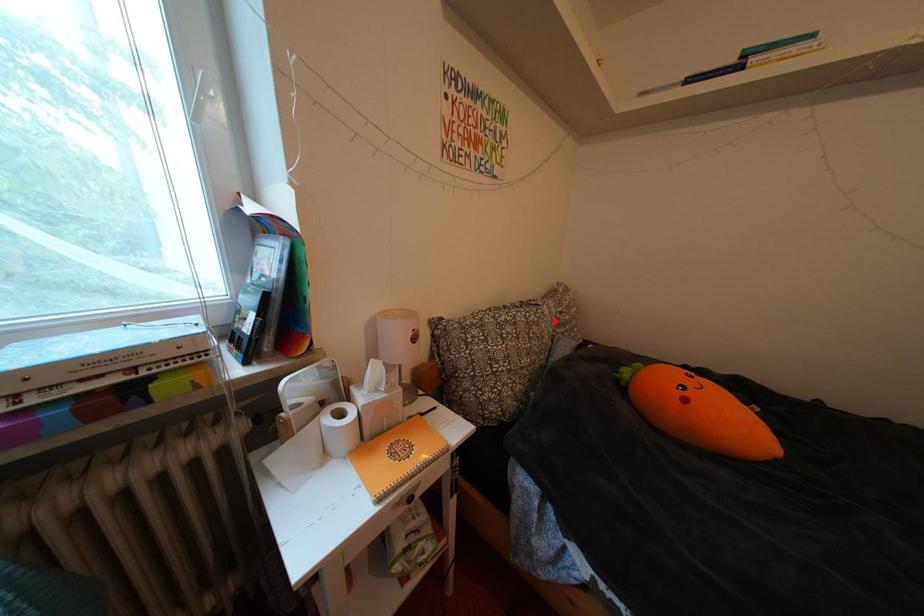
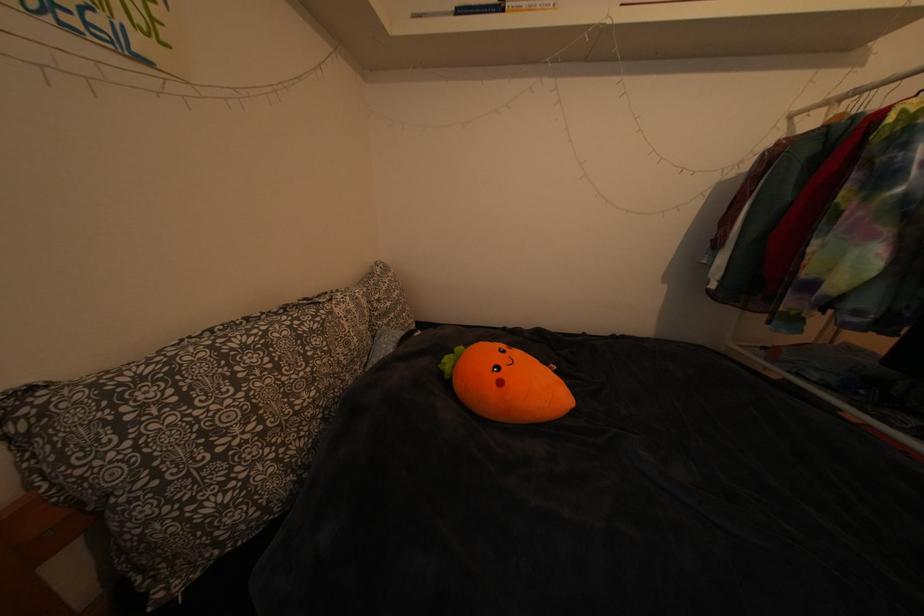
Question: I am providing you with two images of the same scene from different viewpoints. A red point is shown in image1. For the corresponding object point in image2, is it positioned nearer or farther from the camera?

Choices:
 (A) Nearer
 (B) Farther

Answer: (A)